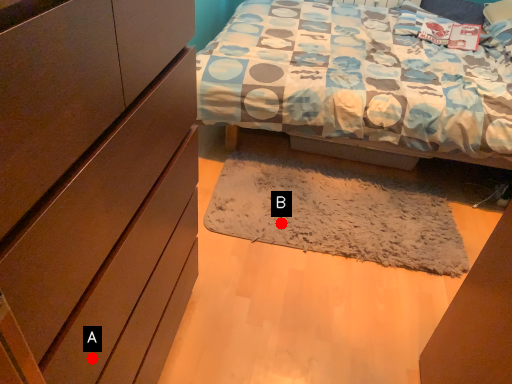
Question: Two points are circled on the image, labeled by A and B beside each circle. Among these points, which one is farthest from the camera?

Choices:
 (A) A is further
 (B) B is further

Answer: (B)